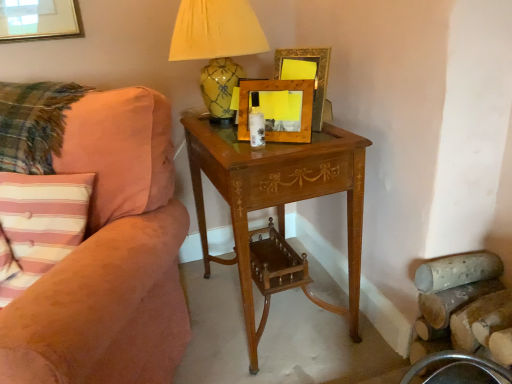
I want to click on free location to the right of wooden picture frame at center, which appears as the second picture frame when viewed from the back, so click(335, 139).